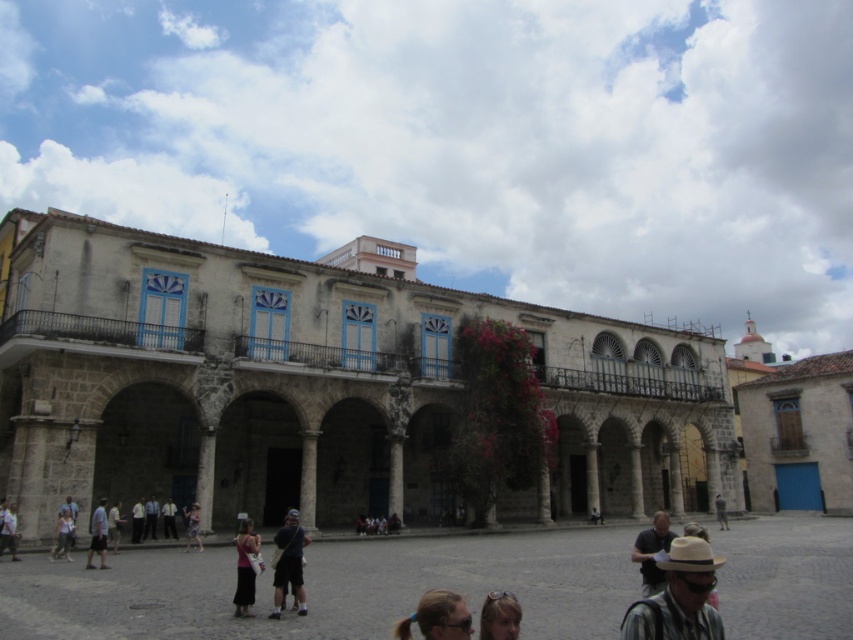
You are a photographer standing in the plaza in front of the historic building. You want to capture a photo that includes both the blonde hair at lower center and the dark gray shirt at lower right. Which object should you focus on first to ensure both are in the frame?

The blonde hair at lower center is positioned over the dark gray shirt at lower right, so focusing on the blonde hair at lower center first will ensure both are in the frame since it is closer to the camera.

Looking at this image, you are a photographer standing in the plaza and want to capture both the blonde hair at lower center and the dark gray shirt at lower right in the same frame. Based on their sizes in the image, which object would you need to focus on more closely to ensure both fit in the frame?

The blonde hair at lower center occupies less space than the dark gray shirt at lower right, so you should focus on the dark gray shirt at lower right since it is larger and requires more attention to ensure both fit in the frame.